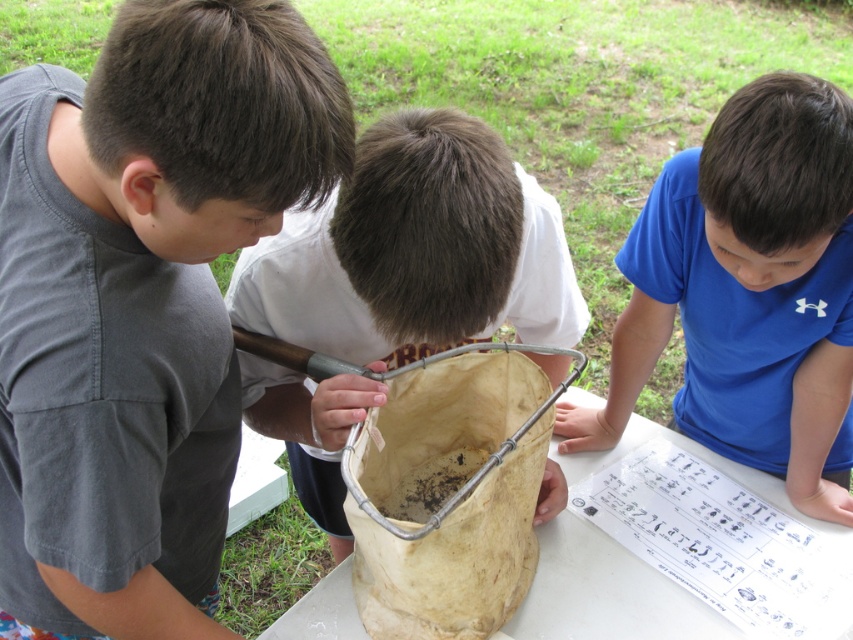
Question: Is gray matte shirt at left thinner than light brown paper bag at center?

Choices:
 (A) no
 (B) yes

Answer: (B)

Question: Does gray matte shirt at left lie in front of blue cotton shirt at upper right?

Choices:
 (A) no
 (B) yes

Answer: (B)

Question: Among these points, which one is nearest to the camera?

Choices:
 (A) (97, 561)
 (B) (849, 461)
 (C) (347, 317)

Answer: (A)

Question: Which object is the closest to the blue cotton shirt at upper right?

Choices:
 (A) gray matte shirt at left
 (B) light brown paper bag at center

Answer: (B)

Question: Does gray matte shirt at left appear on the left side of light brown paper bag at center?

Choices:
 (A) yes
 (B) no

Answer: (A)

Question: Among these points, which one is nearest to the camera?

Choices:
 (A) (370, 330)
 (B) (799, 177)

Answer: (B)